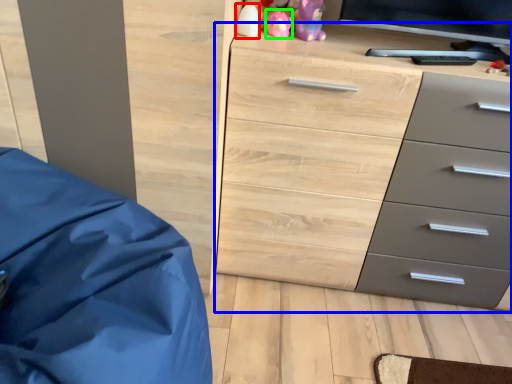
Question: Estimate the real-world distances between objects in this image. Which object is closer to toy (highlighted by a red box), chest of drawers (highlighted by a blue box) or toy (highlighted by a green box)?

Choices:
 (A) chest of drawers
 (B) toy

Answer: (B)